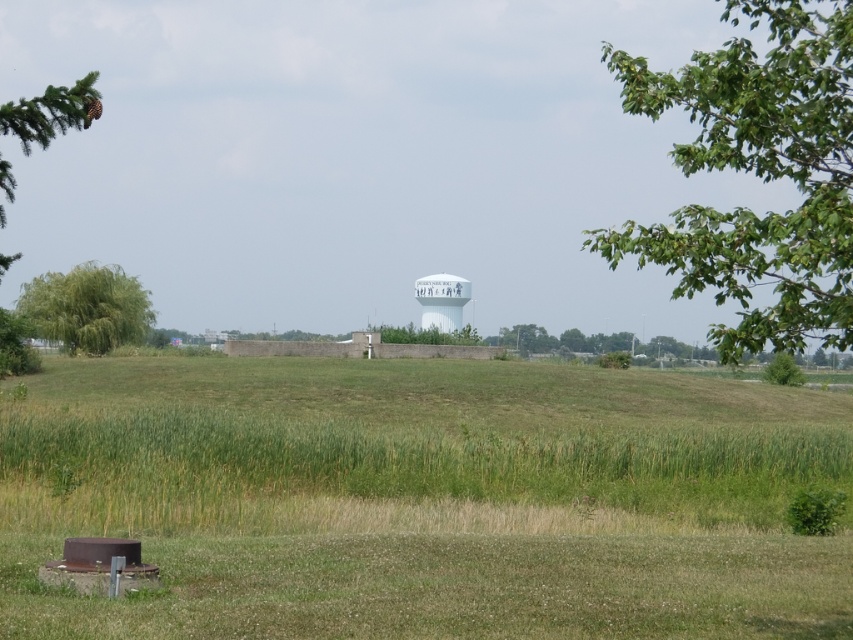
Question: Does green textured pine branch at upper left appear on the right side of white glossy water tower at center?

Choices:
 (A) yes
 (B) no

Answer: (B)

Question: Which point is closer to the camera?

Choices:
 (A) (688, 106)
 (B) (129, 337)
 (C) (419, 289)
 (D) (30, 365)

Answer: (A)

Question: Is green leafy tree at left smaller than white glossy water tower at center?

Choices:
 (A) yes
 (B) no

Answer: (B)

Question: Does green leafy tree at upper right have a larger size compared to green leafy tree at left?

Choices:
 (A) yes
 (B) no

Answer: (A)

Question: Which point appears farthest from the camera in this image?

Choices:
 (A) (422, 323)
 (B) (120, 294)

Answer: (A)

Question: Which point is closer to the camera?

Choices:
 (A) (32, 120)
 (B) (778, 161)
 (C) (91, 346)

Answer: (B)